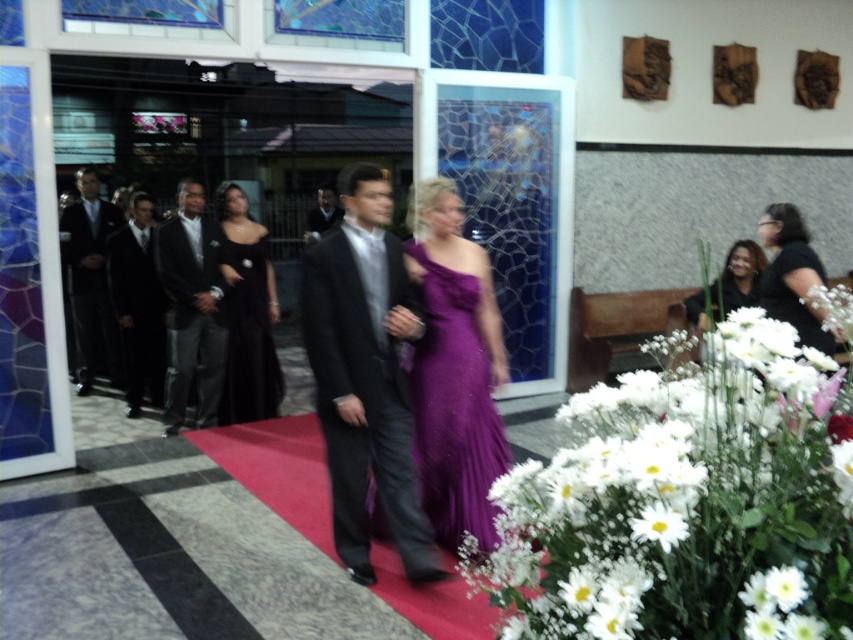
Is shiny black suit at center positioned at the back of white matte flower at lower right?

Yes.

Is shiny black suit at center shorter than white matte flower at lower right?

No, shiny black suit at center is not shorter than white matte flower at lower right.

Locate an element on the screen. The image size is (853, 640). shiny black suit at center is located at coordinates (364, 376).

Can you confirm if shiny black suit at center is taller than black satin dress at center?

In fact, shiny black suit at center may be shorter than black satin dress at center.

Between shiny black suit at center and black satin dress at center, which one appears on the left side from the viewer's perspective?

black satin dress at center is more to the left.

Identify the location of shiny black suit at center. (364, 376).

The image size is (853, 640). What are the coordinates of `shiny black suit at center` in the screenshot? It's located at (364, 376).

Does white matte flowers at right appear under black satin tuxedo at left?

Correct, white matte flowers at right is located below black satin tuxedo at left.

Find the location of `white matte flowers at right`. white matte flowers at right is located at coordinates (688, 500).